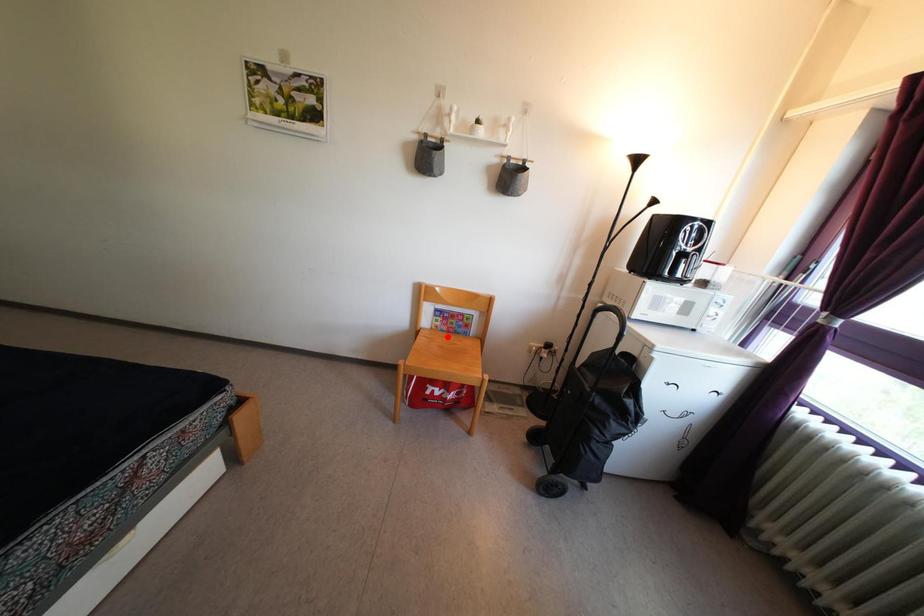
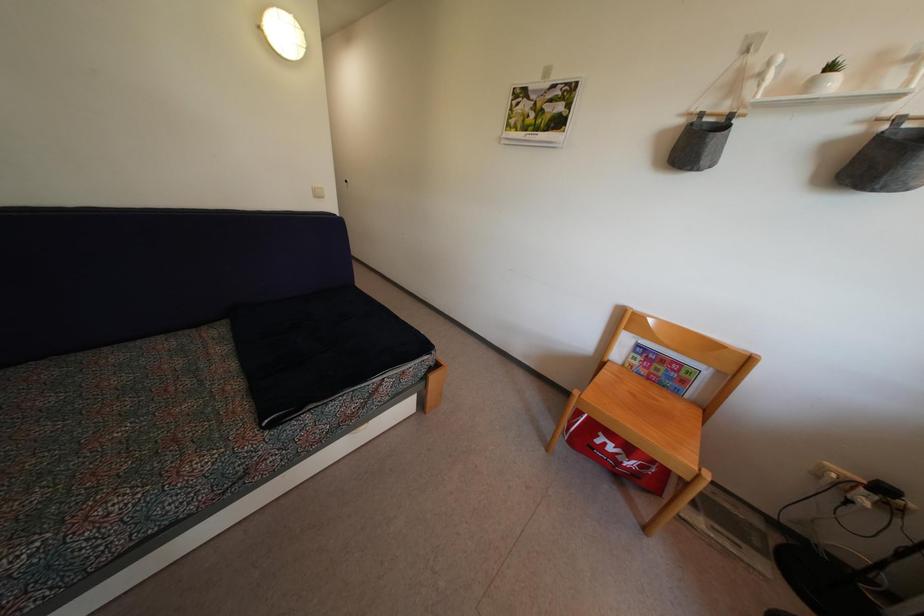
Find the pixel in the second image that matches the highlighted location in the first image.

(647, 381)